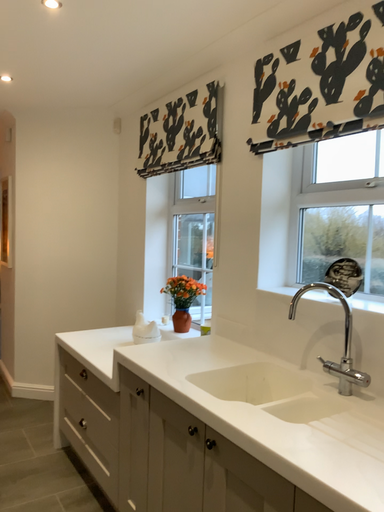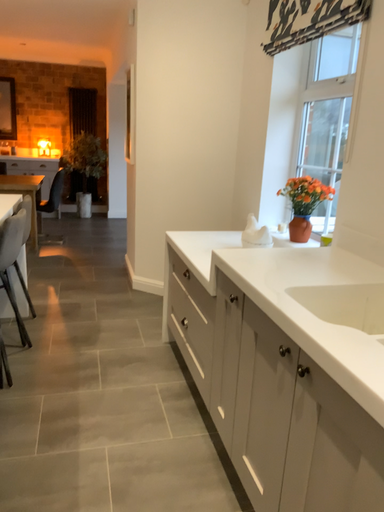
Question: Which way did the camera rotate in the video?

Choices:
 (A) rotated right
 (B) rotated left

Answer: (B)